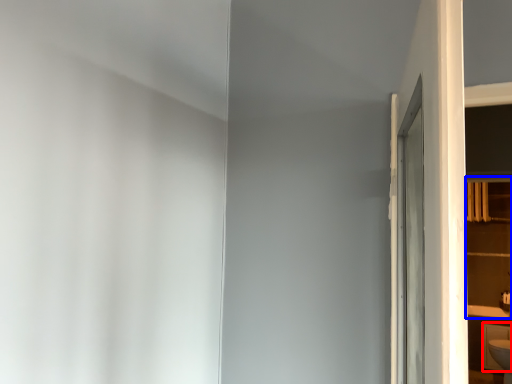
Question: Which point is further to the camera, cabinetry (highlighted by a red box) or shelf (highlighted by a blue box)?

Choices:
 (A) cabinetry
 (B) shelf

Answer: (A)